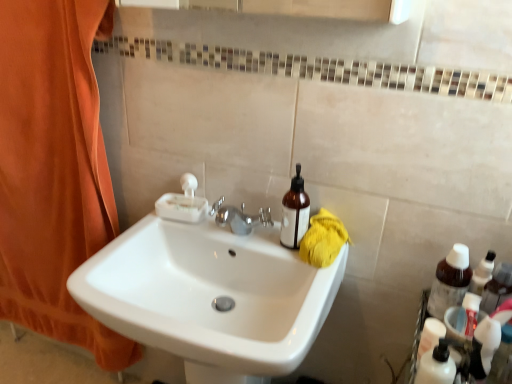
This screenshot has height=384, width=512. What do you see at coordinates (295, 212) in the screenshot? I see `brown glass bottle at right` at bounding box center [295, 212].

Describe the element at coordinates (436, 365) in the screenshot. The image size is (512, 384). I see `white plastic pump bottle at lower right` at that location.

What do you see at coordinates (54, 170) in the screenshot? This screenshot has width=512, height=384. I see `orange fabric curtain at left` at bounding box center [54, 170].

Image resolution: width=512 pixels, height=384 pixels. What do you see at coordinates (450, 281) in the screenshot?
I see `brown translucent bottle at right` at bounding box center [450, 281].

What do you see at coordinates (210, 297) in the screenshot? I see `white glossy sink at center` at bounding box center [210, 297].

Where is `brown glass bottle at right`? The image size is (512, 384). brown glass bottle at right is located at coordinates (295, 212).

From a real-world perspective, relative to white plastic pump bottle at lower right, is orange fabric curtain at left vertically above or below?

orange fabric curtain at left is below white plastic pump bottle at lower right.

Which is more to the left, orange fabric curtain at left or white plastic pump bottle at lower right?

orange fabric curtain at left is more to the left.

In terms of height, does orange fabric curtain at left look taller or shorter compared to white plastic pump bottle at lower right?

orange fabric curtain at left is taller than white plastic pump bottle at lower right.

Does brown translucent bottle at right lie behind white glossy sink at center?

Yes, it is behind white glossy sink at center.

From a real-world perspective, is brown translucent bottle at right located higher than white glossy sink at center?

Yes, from a real-world perspective, brown translucent bottle at right is over white glossy sink at center

From the image's perspective, is brown translucent bottle at right above or below white glossy sink at center?

brown translucent bottle at right is above white glossy sink at center.

Is brown translucent bottle at right oriented away from white glossy sink at center?

brown translucent bottle at right is not turned away from white glossy sink at center.

From the image's perspective, between white plastic pump bottle at lower right and brown glass bottle at right, which one is located above?

brown glass bottle at right.

Consider the image. Is brown glass bottle at right inside white plastic pump bottle at lower right?

No, brown glass bottle at right is not inside white plastic pump bottle at lower right.

Is white plastic pump bottle at lower right oriented towards brown glass bottle at right?

No, white plastic pump bottle at lower right does not turn towards brown glass bottle at right.

Is the depth of white plastic pump bottle at lower right less than that of brown glass bottle at right?

Yes, white plastic pump bottle at lower right is closer to the camera.

Does point (428, 350) come closer to viewer compared to point (464, 251)?

Yes.

In the scene shown: From the image's perspective, is white plastic pump bottle at lower right on brown translucent bottle at right?

Incorrect, from the image's perspective, white plastic pump bottle at lower right is lower than brown translucent bottle at right.

From a real-world perspective, who is located higher, white plastic pump bottle at lower right or brown translucent bottle at right?

From a 3D spatial view, brown translucent bottle at right is above.

From a real-world perspective, is brown glass bottle at right positioned over white plastic pump bottle at lower right based on gravity?

Yes, from a real-world perspective, brown glass bottle at right is over white plastic pump bottle at lower right

Can you confirm if brown glass bottle at right is bigger than white plastic pump bottle at lower right?

Yes.

Is brown glass bottle at right completely or partially outside of white plastic pump bottle at lower right?

Yes, brown glass bottle at right is not within white plastic pump bottle at lower right.

Considering the relative sizes of white glossy sink at center and orange fabric curtain at left in the image provided, is white glossy sink at center taller than orange fabric curtain at left?

Incorrect, the height of white glossy sink at center is not larger of that of orange fabric curtain at left.

Is white glossy sink at center smaller than orange fabric curtain at left?

Actually, white glossy sink at center might be larger than orange fabric curtain at left.

Which of these two, white glossy sink at center or orange fabric curtain at left, is thinner?

With smaller width is orange fabric curtain at left.

Is point (231, 317) positioned before point (9, 36)?

Yes, point (231, 317) is in front of point (9, 36).

Is white glossy sink at center turned away from brown translucent bottle at right?

No, white glossy sink at center is not facing the opposite direction of brown translucent bottle at right.

Considering the relative sizes of white glossy sink at center and brown translucent bottle at right in the image provided, is white glossy sink at center smaller than brown translucent bottle at right?

Incorrect, white glossy sink at center is not smaller in size than brown translucent bottle at right.

From a real-world perspective, which is physically above, white glossy sink at center or brown translucent bottle at right?

In real-world perspective, brown translucent bottle at right is above.

In the image, is white glossy sink at center positioned in front of or behind brown translucent bottle at right?

white glossy sink at center is in front of brown translucent bottle at right.

Where is `toiletry to the right of orange fabric curtain at left`? The height and width of the screenshot is (384, 512). toiletry to the right of orange fabric curtain at left is located at coordinates (436, 365).

Locate an element on the screen. The width and height of the screenshot is (512, 384). sink in front of the brown translucent bottle at right is located at coordinates (210, 297).

Based on the photo, considering their positions, is white plastic pump bottle at lower right positioned further to orange fabric curtain at left than white glossy sink at center?

white plastic pump bottle at lower right is positioned further to the anchor orange fabric curtain at left.

Looking at the image, which one is located further to white glossy sink at center, brown translucent bottle at right or brown glass bottle at right?

Among the two, brown translucent bottle at right is located further to white glossy sink at center.

Considering their positions, is white glossy sink at center positioned closer to brown glass bottle at right than white plastic pump bottle at lower right?

Among the two, white glossy sink at center is located nearer to brown glass bottle at right.

Based on their spatial positions, is white plastic pump bottle at lower right or white glossy sink at center further from brown glass bottle at right?

Based on the image, white plastic pump bottle at lower right appears to be further to brown glass bottle at right.

Estimate the real-world distances between objects in this image. Which object is closer to white glossy sink at center, white plastic pump bottle at lower right or brown glass bottle at right?

Among the two, brown glass bottle at right is located nearer to white glossy sink at center.

Based on their spatial positions, is brown glass bottle at right or brown translucent bottle at right further from white plastic pump bottle at lower right?

The object further to white plastic pump bottle at lower right is brown glass bottle at right.

In the scene shown: Estimate the real-world distances between objects in this image. Which object is closer to white glossy sink at center, brown translucent bottle at right or white plastic pump bottle at lower right?

Among the two, white plastic pump bottle at lower right is located nearer to white glossy sink at center.

Looking at this image, from the image, which object appears to be nearer to orange fabric curtain at left, white glossy sink at center or brown translucent bottle at right?

white glossy sink at center.

Find the location of `sink between orange fabric curtain at left and white plastic pump bottle at lower right`. sink between orange fabric curtain at left and white plastic pump bottle at lower right is located at coordinates (210, 297).

Identify the location of mouthwash situated between white glossy sink at center and brown translucent bottle at right from left to right. The width and height of the screenshot is (512, 384). (295, 212).

The image size is (512, 384). Find the location of `toiletry between orange fabric curtain at left and brown translucent bottle at right in the horizontal direction`. toiletry between orange fabric curtain at left and brown translucent bottle at right in the horizontal direction is located at coordinates (436, 365).

At what (x,y) coordinates should I click in order to perform the action: click on toiletry between brown glass bottle at right and white glossy sink at center in the up-down direction. Please return your answer as a coordinate pair (x, y). Looking at the image, I should click on (436, 365).